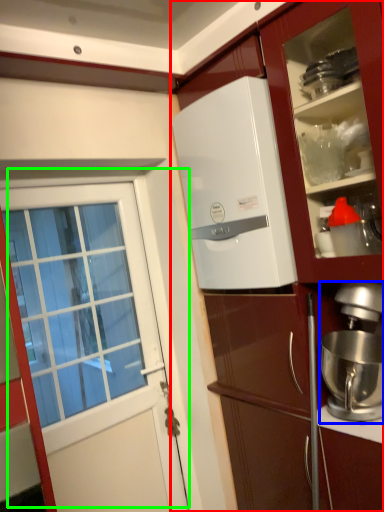
Question: Estimate the real-world distances between objects in this image. Which object is farther from cabinetry (highlighted by a red box), kitchen appliance (highlighted by a blue box) or door (highlighted by a green box)?

Choices:
 (A) kitchen appliance
 (B) door

Answer: (B)